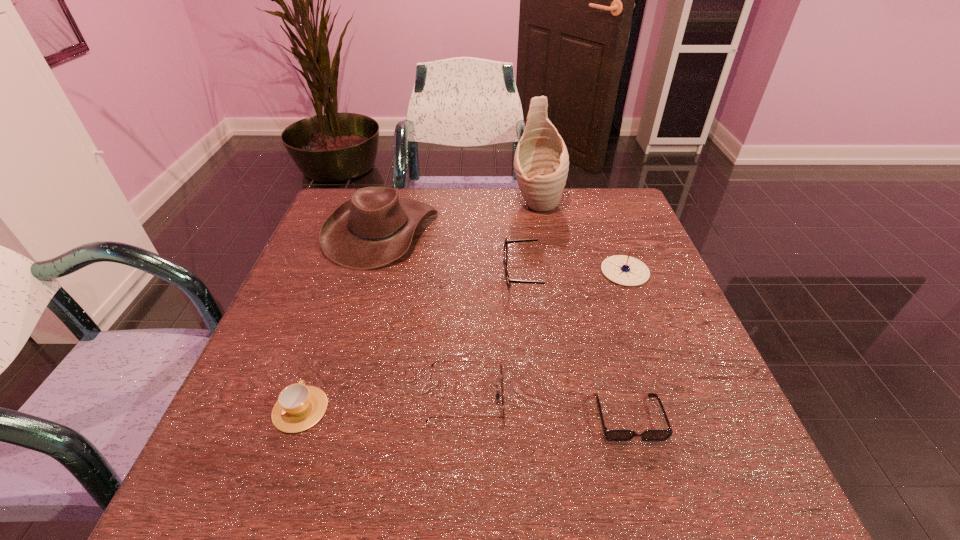
What are the coordinates of `the tallest object` in the screenshot? It's located at (541, 162).

You are a GUI agent. You are given a task and a screenshot of the screen. Output one action in this format:
    pyautogui.click(x=<x>, y=<y>)
    Task: Click on the cowboy hat
    This screenshot has height=540, width=960.
    Given the screenshot: What is the action you would take?
    pyautogui.click(x=373, y=228)

Find the location of a particular element. The image size is (960, 540). compass is located at coordinates (621, 269).

Locate an element on the screen. This screenshot has width=960, height=540. spectacles is located at coordinates (509, 281).

Where is `cup`? cup is located at coordinates (299, 407).

Locate an element on the screen. This screenshot has width=960, height=540. the left sunglasses is located at coordinates (501, 373).

Locate an element on the screen. the right sunglasses is located at coordinates (612, 435).

Find the location of `free region located 0.140m at the spout of the pitcher`. free region located 0.140m at the spout of the pitcher is located at coordinates (545, 250).

Find the location of a particular element. This screenshot has width=960, height=540. vacant region located on the front of the cowboy hat is located at coordinates (359, 308).

Locate an element on the screen. free space located on the back of the compass is located at coordinates (606, 221).